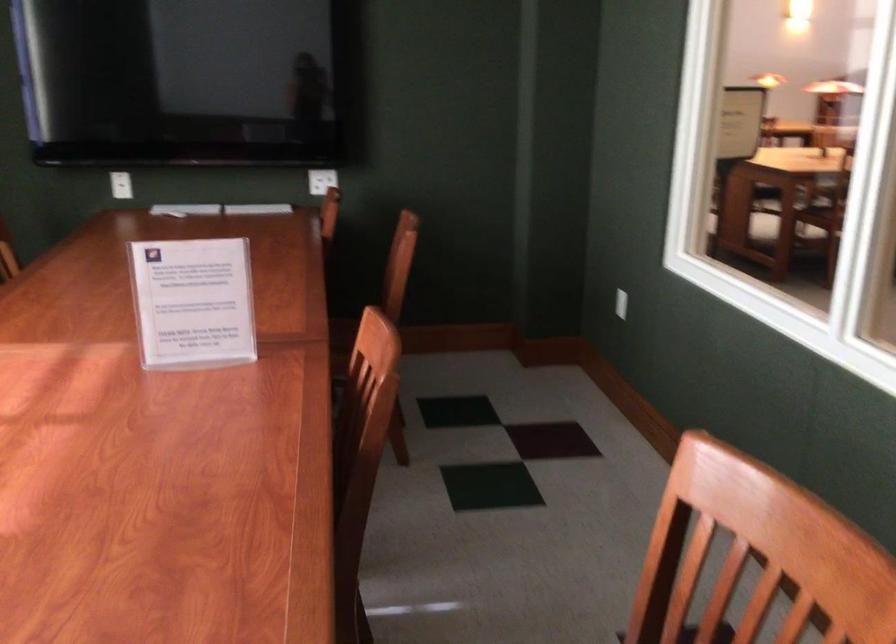
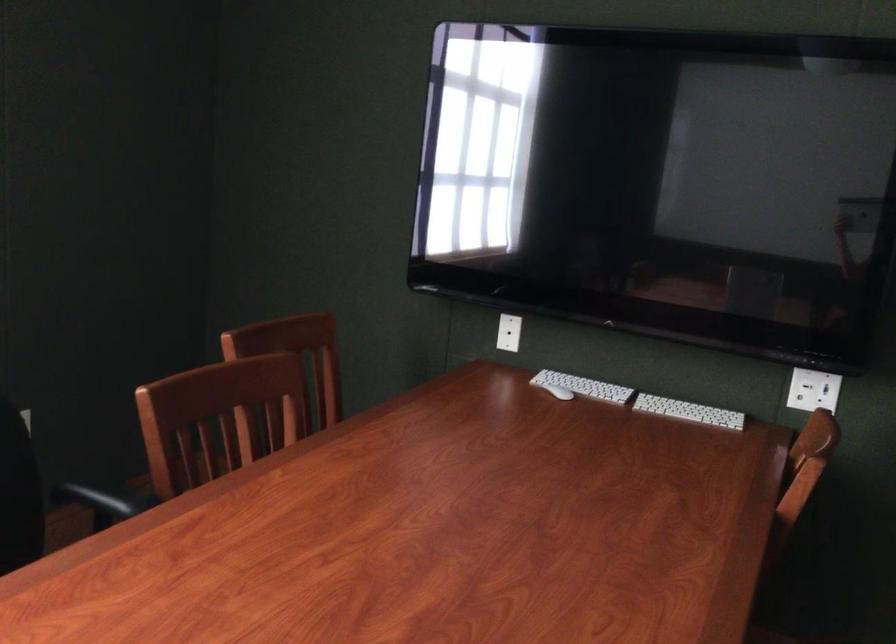
Locate, in the second image, the point that corresponds to (263,205) in the first image.

(688, 412)